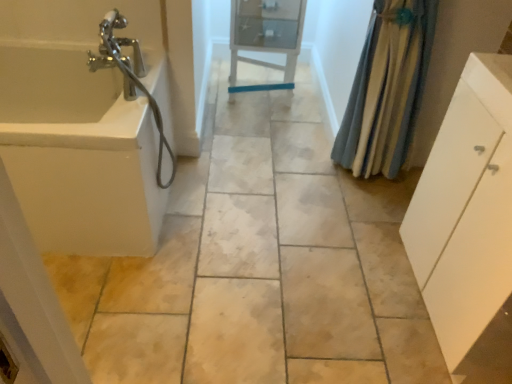
Image resolution: width=512 pixels, height=384 pixels. What do you see at coordinates (466, 209) in the screenshot? I see `white matte cabinet at right` at bounding box center [466, 209].

Describe the element at coordinates (266, 36) in the screenshot. I see `white glossy cabinet at center` at that location.

Image resolution: width=512 pixels, height=384 pixels. What do you see at coordinates (387, 88) in the screenshot?
I see `blue textured fabric shower curtain at right` at bounding box center [387, 88].

In order to face white glossy bathtub at left, should I rotate leftwards or rightwards?

You should rotate left by 24.961 degrees.

Image resolution: width=512 pixels, height=384 pixels. What are the coordinates of `white matte cabinet at right` in the screenshot? It's located at (466, 209).

Find the location of a particular element. bath that is below the blue textured fabric shower curtain at right (from the image's perspective) is located at coordinates (79, 153).

Would you consider white glossy bathtub at left to be distant from blue textured fabric shower curtain at right?

That's right, there is a large distance between white glossy bathtub at left and blue textured fabric shower curtain at right.

Does white glossy bathtub at left have a greater width compared to blue textured fabric shower curtain at right?

Yes, white glossy bathtub at left is wider than blue textured fabric shower curtain at right.

Between white glossy bathtub at left and white matte cabinet at right, which one has larger size?

white glossy bathtub at left is bigger.

From the image's perspective, between white glossy bathtub at left and white matte cabinet at right, which one is located above?

From the image's view, white glossy bathtub at left is above.

Can you tell me how much white glossy bathtub at left and white matte cabinet at right differ in facing direction?

They differ by 90.2 degrees in their facing directions.

Which is in front, white glossy bathtub at left or white matte cabinet at right?

white matte cabinet at right is more forward.

From the image's perspective, is white matte cabinet at right located above or below white glossy bathtub at left?

white matte cabinet at right is below white glossy bathtub at left.

Is white matte cabinet at right wider than white glossy bathtub at left?

Incorrect, the width of white matte cabinet at right does not surpass that of white glossy bathtub at left.

How different are the orientations of white matte cabinet at right and white glossy bathtub at left in degrees?

The facing directions of white matte cabinet at right and white glossy bathtub at left are 90.2 degrees apart.

Is white matte cabinet at right oriented away from white glossy bathtub at left?

No, white matte cabinet at right is not facing away from white glossy bathtub at left.

From the image's perspective, is white glossy cabinet at center below blue textured fabric shower curtain at right?

Incorrect, from the image's perspective, white glossy cabinet at center is higher than blue textured fabric shower curtain at right.

Can you confirm if white glossy cabinet at center is wider than blue textured fabric shower curtain at right?

Correct, the width of white glossy cabinet at center exceeds that of blue textured fabric shower curtain at right.

Locate an element on the screen. Image resolution: width=512 pixels, height=384 pixels. cabinetry below the blue textured fabric shower curtain at right (from a real-world perspective) is located at coordinates (266, 36).

Is white glossy cabinet at center smaller than blue textured fabric shower curtain at right?

Incorrect, white glossy cabinet at center is not smaller in size than blue textured fabric shower curtain at right.

Between blue textured fabric shower curtain at right and white glossy bathtub at left, which one has larger size?

white glossy bathtub at left.

Is point (401, 26) farther from camera compared to point (48, 60)?

No, it is not.

Locate an element on the screen. The image size is (512, 384). shower curtain behind the white glossy bathtub at left is located at coordinates (387, 88).

Could you tell me if blue textured fabric shower curtain at right is turned towards white glossy bathtub at left?

No, blue textured fabric shower curtain at right is not oriented towards white glossy bathtub at left.

Is white glossy cabinet at center aimed at white glossy bathtub at left?

No, white glossy cabinet at center is not turned towards white glossy bathtub at left.

Image resolution: width=512 pixels, height=384 pixels. I want to click on bath below the white glossy cabinet at center (from the image's perspective), so click(x=79, y=153).

Which object is closer to the camera taking this photo, white glossy cabinet at center or white glossy bathtub at left?

white glossy bathtub at left is in front.

Considering the sizes of objects white glossy cabinet at center and white glossy bathtub at left in the image provided, who is bigger, white glossy cabinet at center or white glossy bathtub at left?

With larger size is white glossy bathtub at left.

Is white glossy cabinet at center surrounded by white glossy bathtub at left?

That's incorrect, white glossy cabinet at center is not inside white glossy bathtub at left.

Can you confirm if white glossy bathtub at left is positioned to the right of white glossy cabinet at center?

Incorrect, white glossy bathtub at left is not on the right side of white glossy cabinet at center.

Is the surface of white glossy bathtub at left in direct contact with white glossy cabinet at center?

No, white glossy bathtub at left is not in contact with white glossy cabinet at center.

From the image's perspective, is white glossy bathtub at left located beneath white glossy cabinet at center?

Correct, white glossy bathtub at left appears lower than white glossy cabinet at center in the image.

In the image, there is a blue textured fabric shower curtain at right. At what (x,y) coordinates should I click in order to perform the action: click on bath below it (from the image's perspective). Please return your answer as a coordinate pair (x, y). The width and height of the screenshot is (512, 384). Looking at the image, I should click on (79, 153).

Where is `bathroom cabinet above the white glossy bathtub at left (from a real-world perspective)`? bathroom cabinet above the white glossy bathtub at left (from a real-world perspective) is located at coordinates (466, 209).

When comparing their distances from blue textured fabric shower curtain at right, does white matte cabinet at right or white glossy cabinet at center seem further?

Among the two, white glossy cabinet at center is located further to blue textured fabric shower curtain at right.

Based on their spatial positions, is white glossy cabinet at center or blue textured fabric shower curtain at right further from white glossy bathtub at left?

Among the two, blue textured fabric shower curtain at right is located further to white glossy bathtub at left.

When comparing their distances from white glossy cabinet at center, does white glossy bathtub at left or white matte cabinet at right seem further?

Among the two, white matte cabinet at right is located further to white glossy cabinet at center.

Considering their positions, is white matte cabinet at right positioned further to white glossy cabinet at center than blue textured fabric shower curtain at right?

The object further to white glossy cabinet at center is white matte cabinet at right.

From the image, which object appears to be farther from white matte cabinet at right, white glossy bathtub at left or white glossy cabinet at center?

white glossy cabinet at center is positioned further to the anchor white matte cabinet at right.

From the image, which object appears to be farther from white matte cabinet at right, white glossy cabinet at center or blue textured fabric shower curtain at right?

Based on the image, white glossy cabinet at center appears to be further to white matte cabinet at right.

Estimate the real-world distances between objects in this image. Which object is further from white glossy bathtub at left, blue textured fabric shower curtain at right or white glossy cabinet at center?

blue textured fabric shower curtain at right lies further to white glossy bathtub at left than the other object.

Based on their spatial positions, is blue textured fabric shower curtain at right or white matte cabinet at right further from white glossy cabinet at center?

Among the two, white matte cabinet at right is located further to white glossy cabinet at center.

Image resolution: width=512 pixels, height=384 pixels. In order to click on cabinetry situated between white glossy bathtub at left and blue textured fabric shower curtain at right from left to right in this screenshot , I will do `click(266, 36)`.

The width and height of the screenshot is (512, 384). Find the location of `cabinetry located between white glossy bathtub at left and white matte cabinet at right in the left-right direction`. cabinetry located between white glossy bathtub at left and white matte cabinet at right in the left-right direction is located at coordinates (266, 36).

You are a GUI agent. You are given a task and a screenshot of the screen. Output one action in this format:
    pyautogui.click(x=<x>, y=<y>)
    Task: Click on the shower curtain located between white matte cabinet at right and white glossy cabinet at center in the depth direction
    Image resolution: width=512 pixels, height=384 pixels.
    Given the screenshot: What is the action you would take?
    pyautogui.click(x=387, y=88)

At what (x,y) coordinates should I click in order to perform the action: click on shower curtain located between white glossy bathtub at left and white matte cabinet at right in the left-right direction. Please return your answer as a coordinate pair (x, y). This screenshot has width=512, height=384. Looking at the image, I should click on (387, 88).